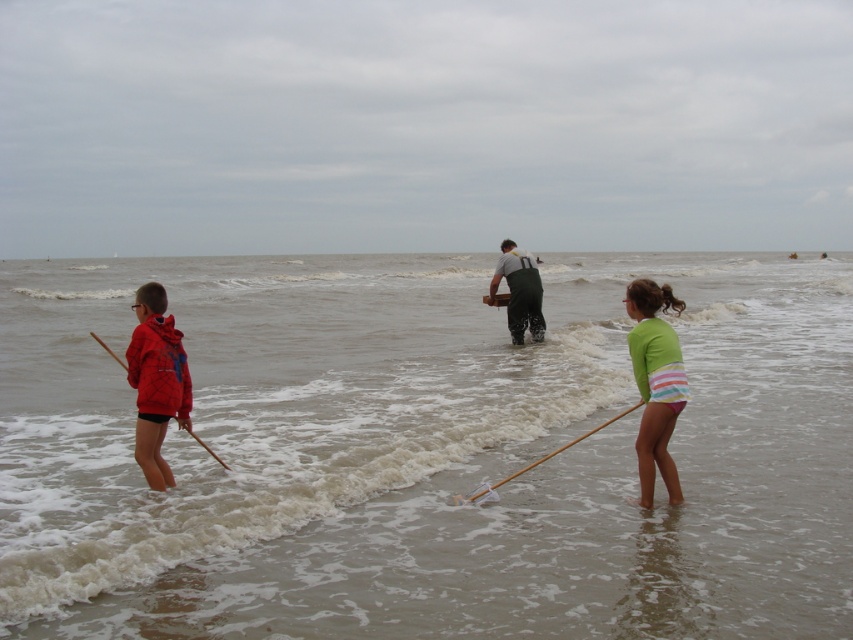
You are a lifeguard on duty at the beach. You notice two people in the water. The first is wearing a matte red hoodie at left, and the second is standing in the brown sandy water at center. Your rescue buoy is 3 meters in diameter. Can you reach both individuals with your buoy if you throw it from your current position?

The distance between the matte red hoodie at left and the brown sandy water at center is 32.36 meters. Since the rescue buoy only has a diameter of 3 meters, it cannot cover such a large distance. Therefore, you cannot reach both individuals with a single throw.

What is located at the coordinates point (519, 291)?

The coordinates point (519, 291) have green rubber boots at center.

You are a photographer trying to capture the children playing at the beach. You want to position yourself so that the green rubber boots at center and the wooden stick at lower center are both visible in your shot. Based on their positions, which object should you place closer to the left side of the frame?

The wooden stick at lower center is to the left of the green rubber boots at center, so to include both in the frame, position the wooden stick at lower center closer to the left side.